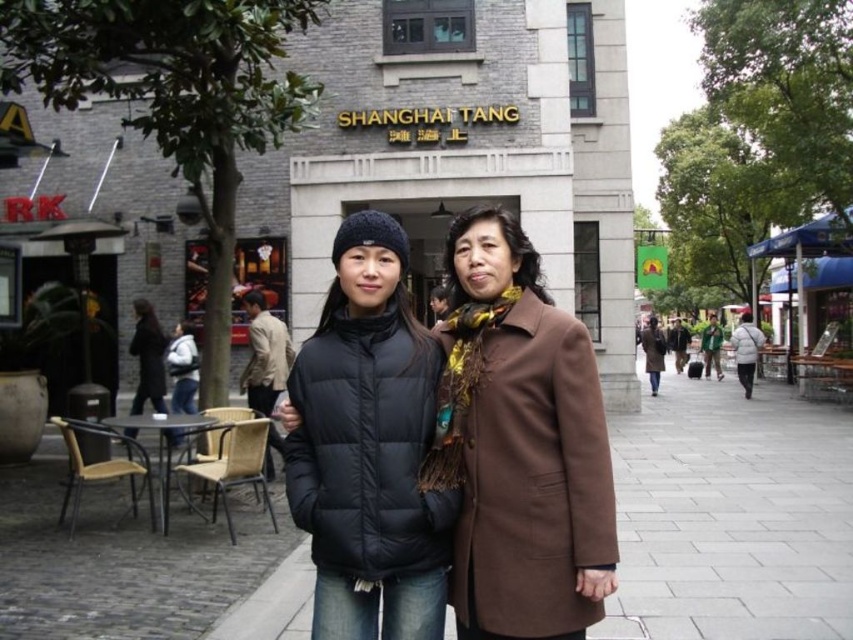
Question: Based on their relative distances, which object is farther from the white matte jacket at center?

Choices:
 (A) black matte jacket at center
 (B) green fabric jacket at center
 (C) black fabric coat at center
 (D) brown wool coat at center

Answer: (C)

Question: Which point is closer to the camera taking this photo?

Choices:
 (A) pyautogui.click(x=254, y=390)
 (B) pyautogui.click(x=791, y=584)

Answer: (B)

Question: In this image, where is beige fabric jacket at center located relative to brown wool coat at center?

Choices:
 (A) above
 (B) below

Answer: (B)

Question: Which point appears closest to the camera in this image?

Choices:
 (A) (706, 368)
 (B) (759, 346)
 (C) (587, 412)
 (D) (679, 353)

Answer: (C)

Question: Can you confirm if beige fabric jacket at center is smaller than white matte jacket at center?

Choices:
 (A) yes
 (B) no

Answer: (A)

Question: Where is brown wool coat at center located in relation to green fabric jacket at center in the image?

Choices:
 (A) below
 (B) above

Answer: (B)